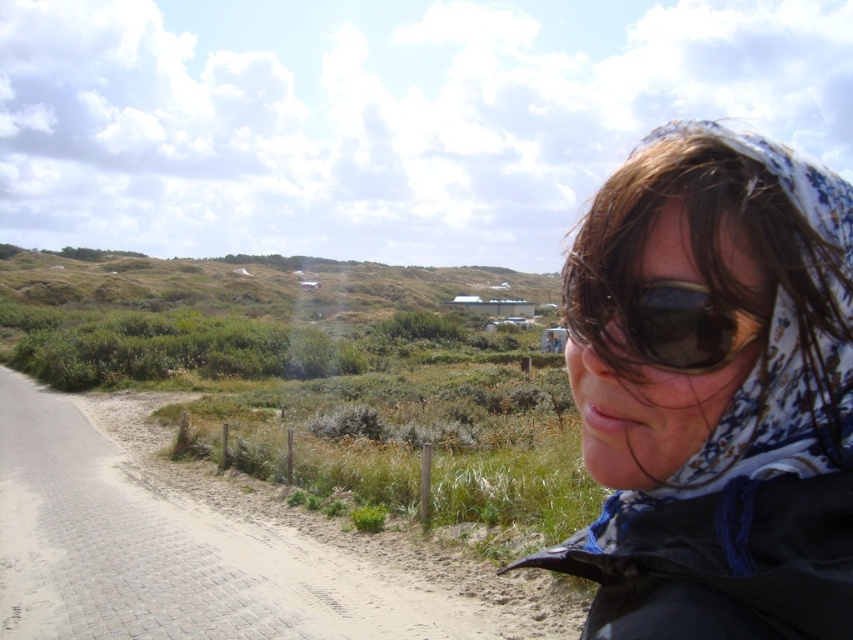
Find the location of a particular element. The width and height of the screenshot is (853, 640). white floral scarf at upper right is located at coordinates (712, 392).

Who is more forward, (735, 339) or (662, 291)?

Positioned in front is point (735, 339).

Between point (769, 508) and point (665, 356), which one is positioned in front?

Positioned in front is point (769, 508).

The width and height of the screenshot is (853, 640). I want to click on white floral scarf at upper right, so click(x=712, y=392).